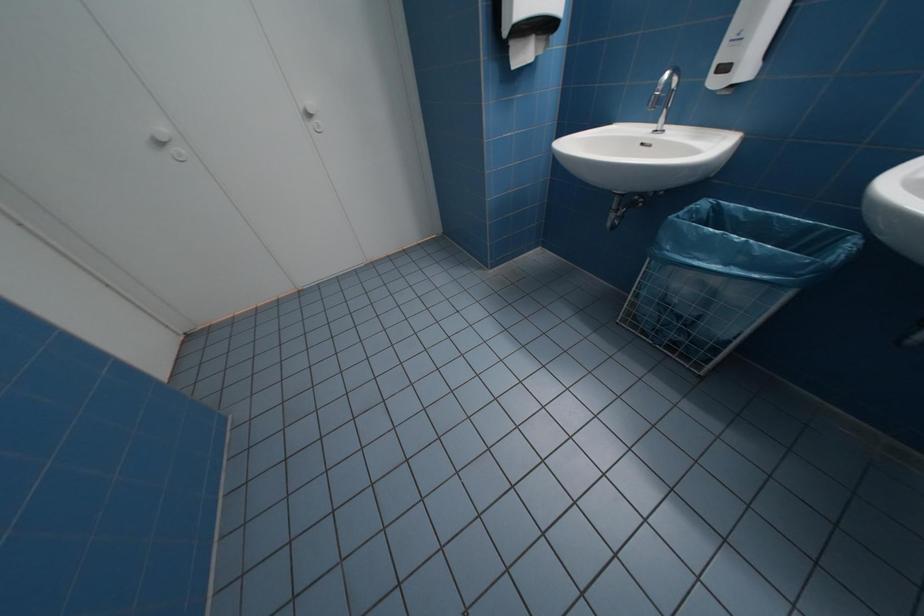
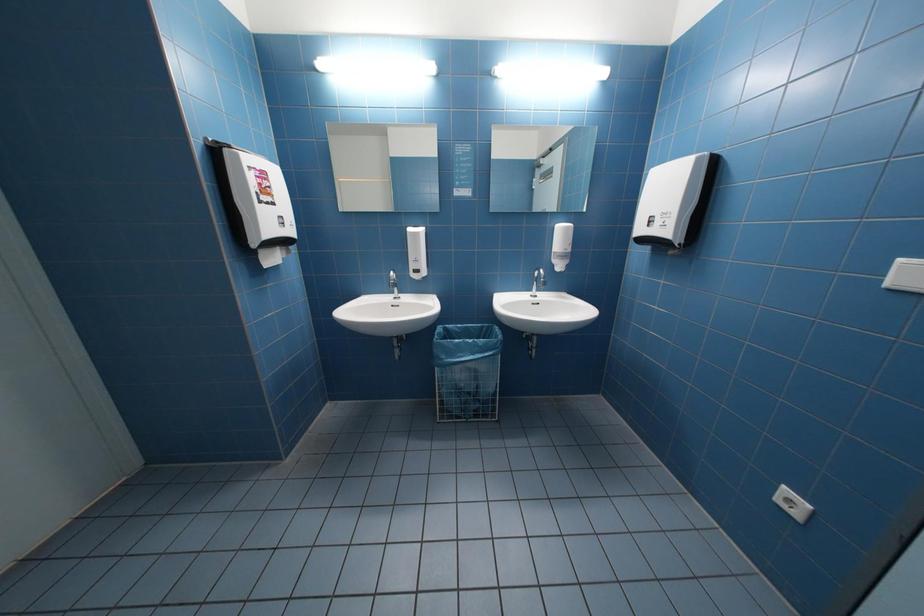
Question: Based on the continuous images, in which direction is the camera rotating? Reply with the corresponding letter.

Choices:
 (A) Left
 (B) Right
 (C) Up
 (D) Down

Answer: (B)